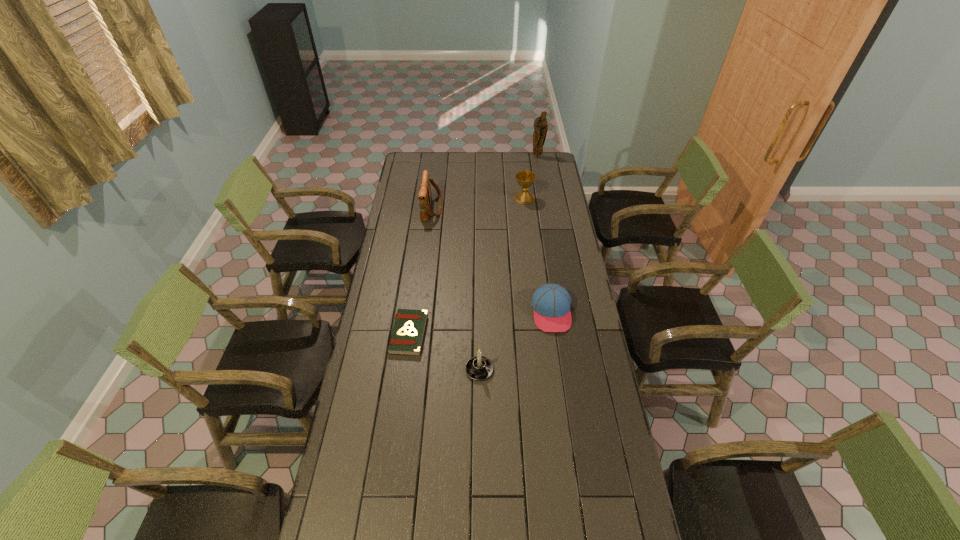
The image size is (960, 540). I want to click on free location that satisfies the following two spatial constraints: 1. on the front-facing side of the tallest object; 2. on the front-facing side of the fifth shortest object, so click(546, 208).

The height and width of the screenshot is (540, 960). I want to click on vacant area in the image that satisfies the following two spatial constraints: 1. with a handle on the side of the candle holder; 2. on the front-facing side of the shoulder bag, so click(479, 208).

What are the coordinates of `free space that satisfies the following two spatial constraints: 1. with a handle on the side of the fourth object from right to left; 2. on the right side of the chalice` in the screenshot? It's located at (480, 198).